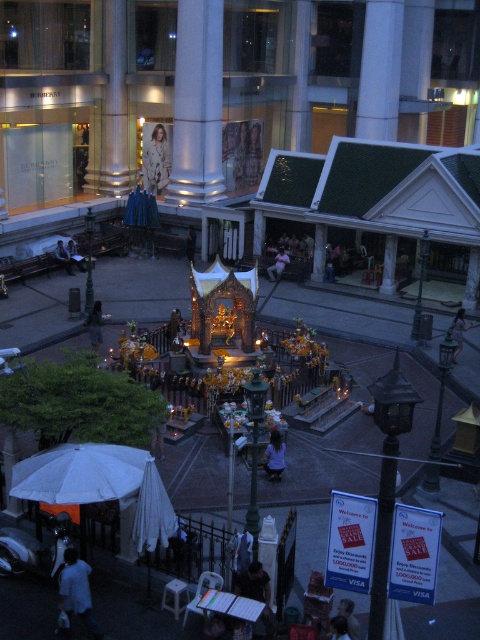
Does white fabric umbrella at lower center have a greater width compared to smooth black hair at center?

Indeed, white fabric umbrella at lower center has a greater width compared to smooth black hair at center.

Is white fabric umbrella at lower center bigger than smooth black hair at center?

Yes.

The height and width of the screenshot is (640, 480). Describe the element at coordinates (153, 512) in the screenshot. I see `white fabric umbrella at lower center` at that location.

This screenshot has width=480, height=640. I want to click on white fabric umbrella at lower center, so click(153, 512).

Is point (152, 193) behind point (346, 630)?

Yes, point (152, 193) is behind point (346, 630).

Does point (144, 141) come in front of point (340, 618)?

That is False.

Locate an element on the screen. This screenshot has width=480, height=640. tan suede coat at center is located at coordinates (156, 156).

Is point (144, 497) positioned after point (184, 244)?

No.

Which is more to the right, white fabric umbrella at lower center or golden statue at center?

Positioned to the right is white fabric umbrella at lower center.

Locate an element on the screen. The height and width of the screenshot is (640, 480). white fabric umbrella at lower center is located at coordinates (153, 512).

What are the coordinates of `white fabric umbrella at lower center` in the screenshot? It's located at (153, 512).